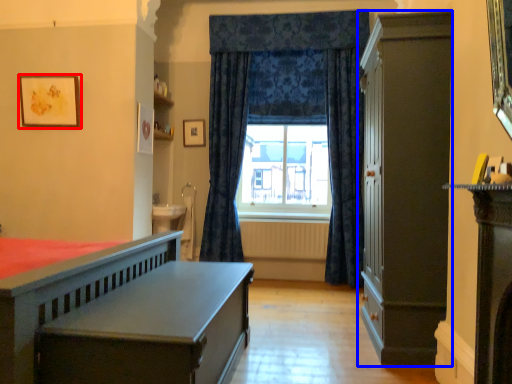
Question: Among these objects, which one is nearest to the camera, picture frame (highlighted by a red box) or cabinetry (highlighted by a blue box)?

Choices:
 (A) picture frame
 (B) cabinetry

Answer: (B)